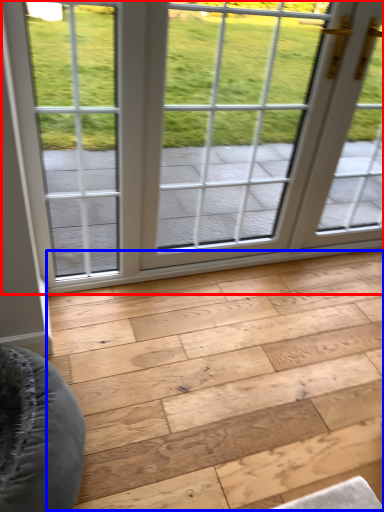
Question: Which point is closer to the camera, window (highlighted by a red box) or plank (highlighted by a blue box)?

Choices:
 (A) window
 (B) plank

Answer: (B)